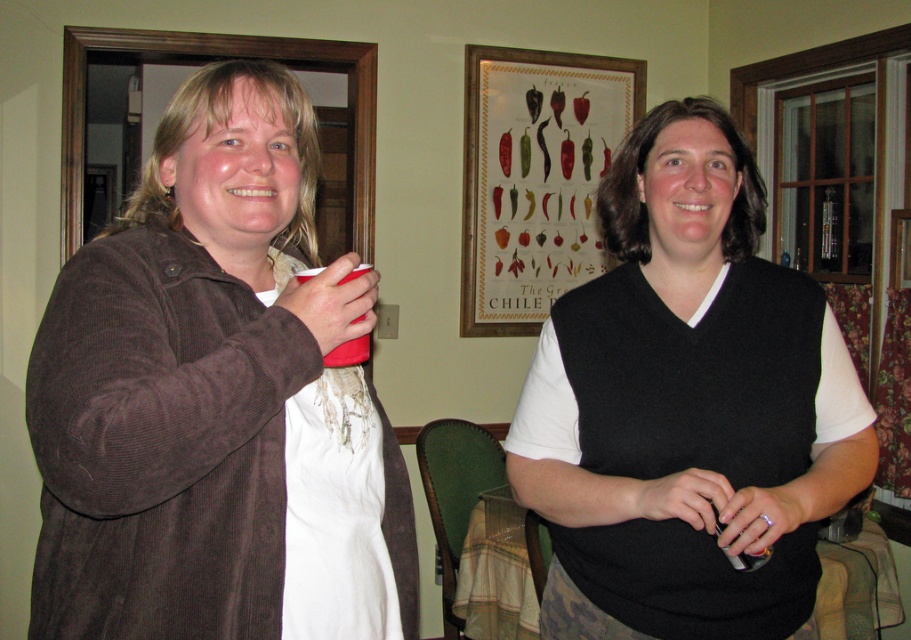
Between brown corduroy jacket at left and black sweater at center, which one has less height?

Standing shorter between the two is brown corduroy jacket at left.

Is brown corduroy jacket at left below black sweater at center?

Actually, brown corduroy jacket at left is above black sweater at center.

I want to click on brown corduroy jacket at left, so click(x=216, y=401).

Can you confirm if black sweater at center is positioned to the right of white lace apron at left?

Yes, black sweater at center is to the right of white lace apron at left.

Which is behind, point (775, 518) or point (344, 484)?

Point (775, 518)

In order to click on black sweater at center in this screenshot , I will do `click(686, 404)`.

Which is below, brown corduroy jacket at left or white lace apron at left?

white lace apron at left

Is brown corduroy jacket at left further to camera compared to white lace apron at left?

No, brown corduroy jacket at left is in front of white lace apron at left.

Describe the element at coordinates (216, 401) in the screenshot. This screenshot has height=640, width=911. I see `brown corduroy jacket at left` at that location.

Where is `brown corduroy jacket at left`? The image size is (911, 640). brown corduroy jacket at left is located at coordinates (216, 401).